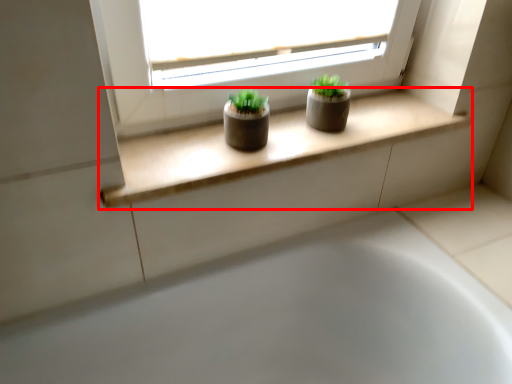
Question: From the image's perspective, what is the correct spatial positioning of window sill (annotated by the red box) in reference to bathtub?

Choices:
 (A) above
 (B) below

Answer: (A)